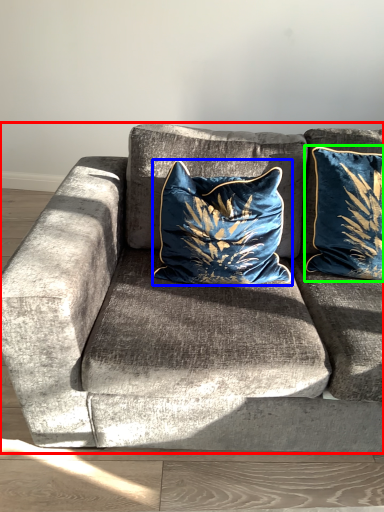
Question: Considering the real-world distances, which object is closest to studio couch (highlighted by a red box)? pillow (highlighted by a blue box) or pillow (highlighted by a green box).

Choices:
 (A) pillow
 (B) pillow

Answer: (A)